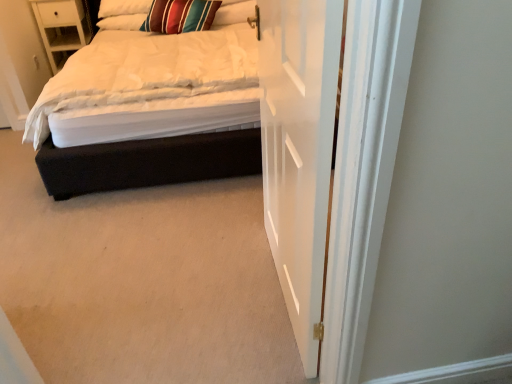
Question: From the image's perspective, is striped fabric pillow at upper center, the 2th pillow from the left, on white wood nightstand at upper left?

Choices:
 (A) yes
 (B) no

Answer: (B)

Question: Is white wood nightstand at upper left at the back of striped fabric pillow at upper center, the 2th pillow from the left?

Choices:
 (A) no
 (B) yes

Answer: (A)

Question: Can you confirm if striped fabric pillow at upper center, the 2th pillow from the left, is positioned to the right of white wood nightstand at upper left?

Choices:
 (A) no
 (B) yes

Answer: (B)

Question: Is there a large distance between striped fabric pillow at upper center, the 2th pillow from the left, and white wood nightstand at upper left?

Choices:
 (A) no
 (B) yes

Answer: (A)

Question: Is white wood nightstand at upper left a part of striped fabric pillow at upper center, the 2th pillow from the left?

Choices:
 (A) yes
 (B) no

Answer: (B)

Question: From a real-world perspective, is velvet black bed at center above or below white wood nightstand at upper left?

Choices:
 (A) above
 (B) below

Answer: (A)

Question: Is velvet black bed at center taller or shorter than white wood nightstand at upper left?

Choices:
 (A) short
 (B) tall

Answer: (B)

Question: Relative to white wood nightstand at upper left, is velvet black bed at center in front or behind?

Choices:
 (A) front
 (B) behind

Answer: (A)

Question: Is velvet black bed at center inside the boundaries of white wood nightstand at upper left, or outside?

Choices:
 (A) outside
 (B) inside

Answer: (A)

Question: Considering the positions of white soft pillow at upper left, acting as the second pillow starting from the right, and white wood nightstand at upper left in the image, is white soft pillow at upper left, acting as the second pillow starting from the right, wider or thinner than white wood nightstand at upper left?

Choices:
 (A) thin
 (B) wide

Answer: (A)

Question: Is white soft pillow at upper left, placed as the 1th pillow when sorted from left to right, taller or shorter than white wood nightstand at upper left?

Choices:
 (A) short
 (B) tall

Answer: (A)

Question: In the image, is white soft pillow at upper left, placed as the 1th pillow when sorted from left to right, on the left side or the right side of white wood nightstand at upper left?

Choices:
 (A) left
 (B) right

Answer: (B)

Question: From the image's perspective, is white soft pillow at upper left, placed as the 1th pillow when sorted from left to right, located above or below white wood nightstand at upper left?

Choices:
 (A) below
 (B) above

Answer: (B)

Question: Does point (101, 28) appear closer or farther from the camera than point (278, 117)?

Choices:
 (A) farther
 (B) closer

Answer: (A)

Question: Considering the positions of white soft pillow at upper left, placed as the 1th pillow when sorted from left to right, and white wooden door at center in the image, is white soft pillow at upper left, placed as the 1th pillow when sorted from left to right, taller or shorter than white wooden door at center?

Choices:
 (A) tall
 (B) short

Answer: (B)